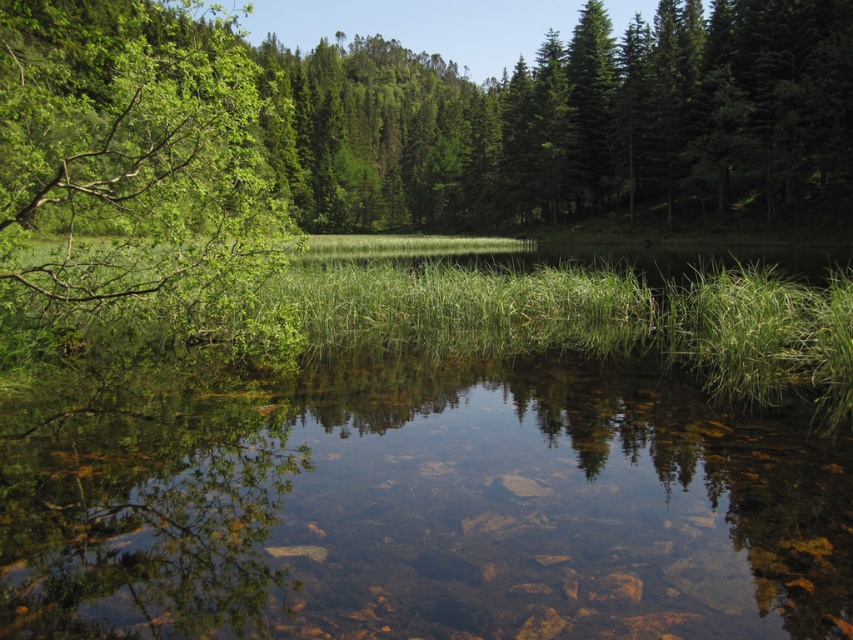
Question: Does clear water at center appear over green leafy tree at left?

Choices:
 (A) no
 (B) yes

Answer: (A)

Question: Which object is the farthest from the green leafy tree at left?

Choices:
 (A) clear water at center
 (B) green grass at center

Answer: (B)

Question: Is green leafy tree at left to the left of green grass at center from the viewer's perspective?

Choices:
 (A) no
 (B) yes

Answer: (B)

Question: Among these objects, which one is nearest to the camera?

Choices:
 (A) clear water at center
 (B) green leafy tree at left
 (C) green grass at center

Answer: (A)

Question: Where is clear water at center located in relation to green grass at center in the image?

Choices:
 (A) below
 (B) above

Answer: (A)

Question: Which point is farther from the camera taking this photo?

Choices:
 (A) (131, 170)
 (B) (152, 632)

Answer: (A)